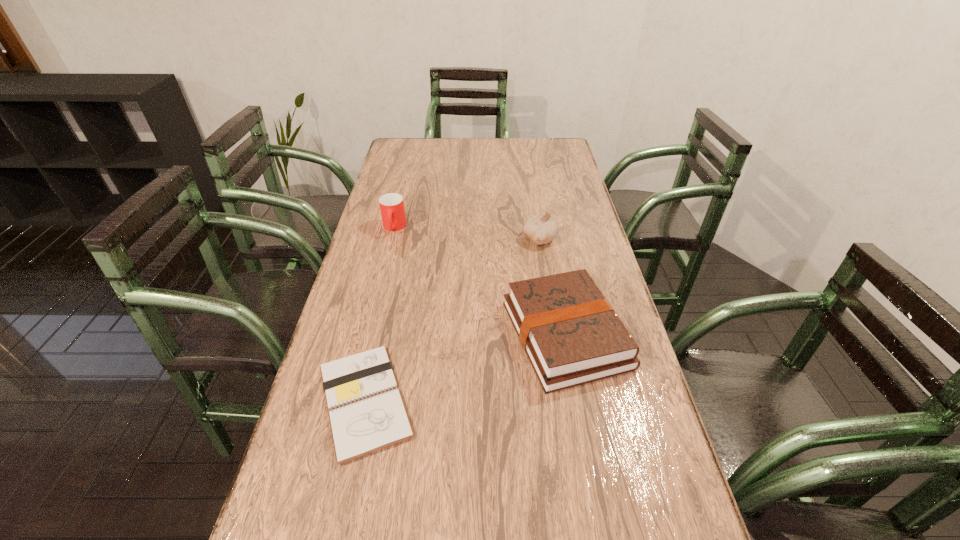
Where is `vacant region that satisfies the following two spatial constraints: 1. on the back side of the shortest object; 2. on the left side of the hardback book`? The image size is (960, 540). vacant region that satisfies the following two spatial constraints: 1. on the back side of the shortest object; 2. on the left side of the hardback book is located at coordinates (379, 335).

You are a GUI agent. You are given a task and a screenshot of the screen. Output one action in this format:
    pyautogui.click(x=<x>, y=<y>)
    Task: Click on the free space that satisfies the following two spatial constraints: 1. on the side of the garlic with the handle; 2. on the left side of the cup
    
    Given the screenshot: What is the action you would take?
    pyautogui.click(x=391, y=239)

You are a GUI agent. You are given a task and a screenshot of the screen. Output one action in this format:
    pyautogui.click(x=<x>, y=<y>)
    Task: Click on the vacant space that satisfies the following two spatial constraints: 1. on the side of the second shortest object with the handle; 2. on the left side of the cup
    The height and width of the screenshot is (540, 960).
    Given the screenshot: What is the action you would take?
    pyautogui.click(x=368, y=335)

You are a GUI agent. You are given a task and a screenshot of the screen. Output one action in this format:
    pyautogui.click(x=<x>, y=<y>)
    Task: Click on the vacant space that satisfies the following two spatial constraints: 1. on the back side of the notepad; 2. on the left side of the garlic
    
    Given the screenshot: What is the action you would take?
    pyautogui.click(x=400, y=239)

The width and height of the screenshot is (960, 540). I want to click on vacant point that satisfies the following two spatial constraints: 1. on the back side of the hardback book; 2. on the right side of the shortest object, so click(379, 335).